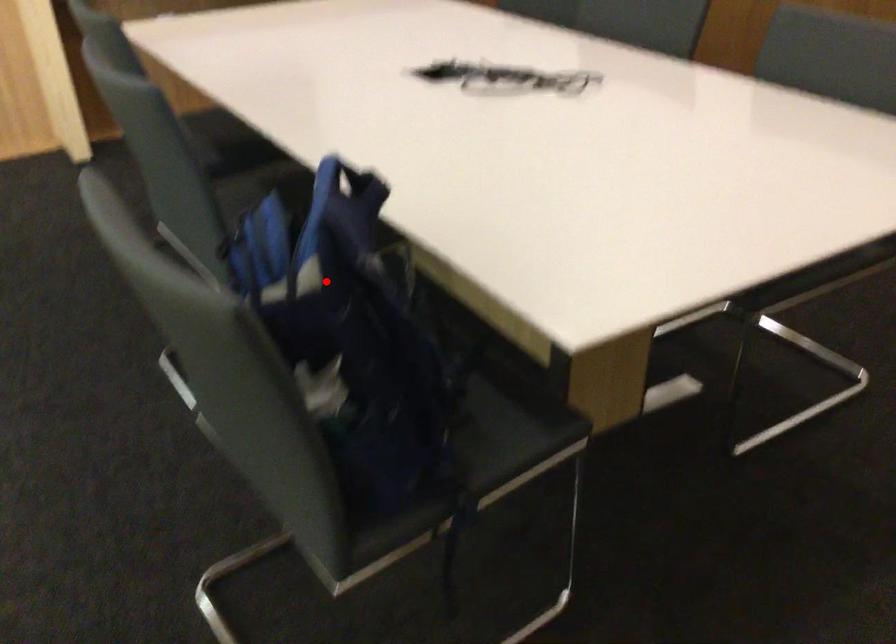
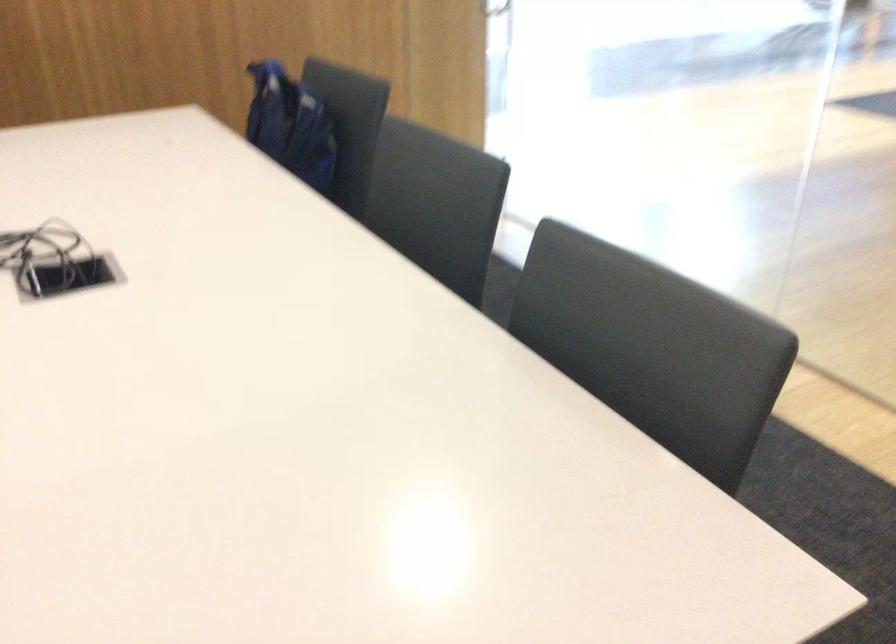
Question: I am providing you with two images of the same scene from different viewpoints. In image1, a red point is highlighted. Considering the same 3D point in image2, which of the following is correct?

Choices:
 (A) It is closer
 (B) It is farther

Answer: (B)